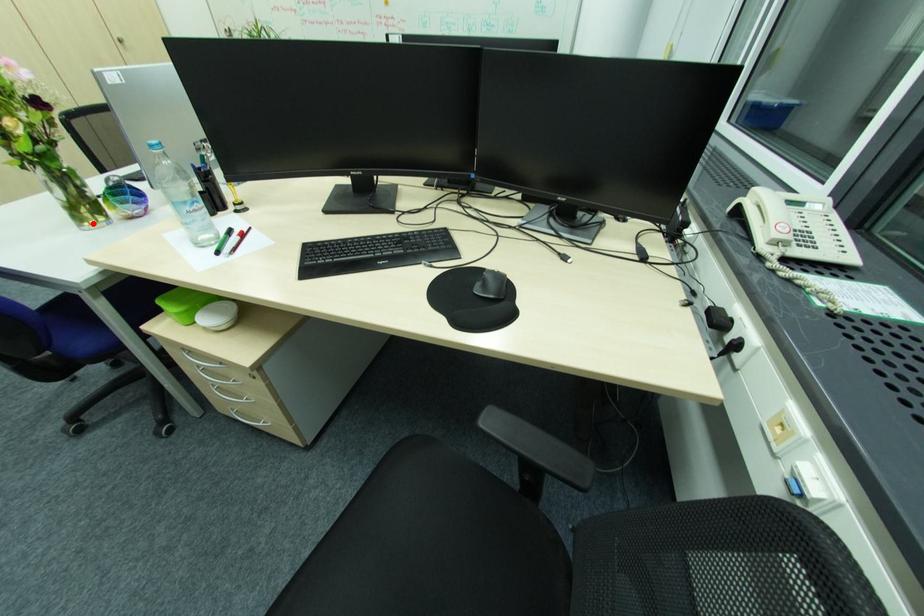
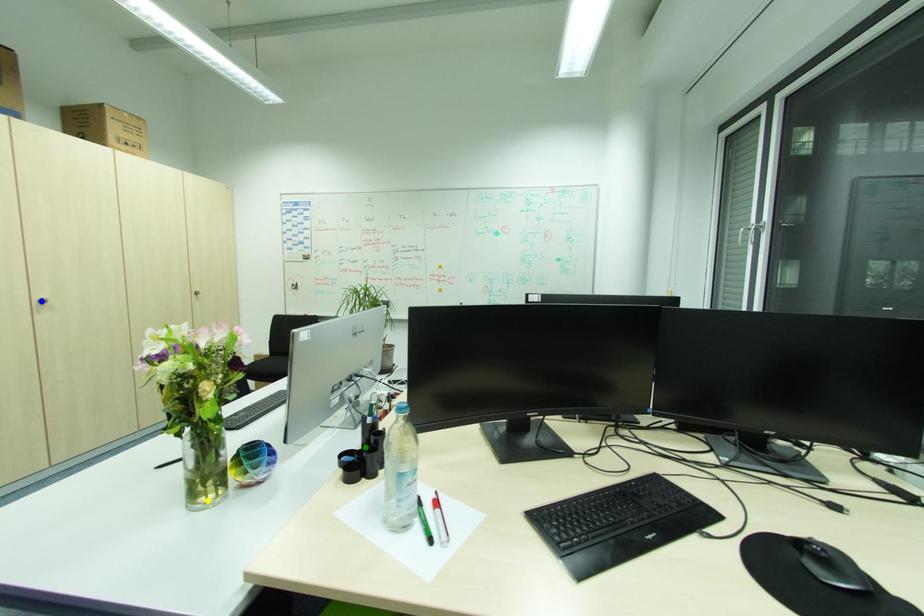
Question: I am providing you with two images of the same scene from different viewpoints. A red point is marked on the first image. You are given multiple points on the second image. Which mark in image 2 goes with the point in image 1?

Choices:
 (A) blue point
 (B) yellow point
 (C) green point

Answer: (B)